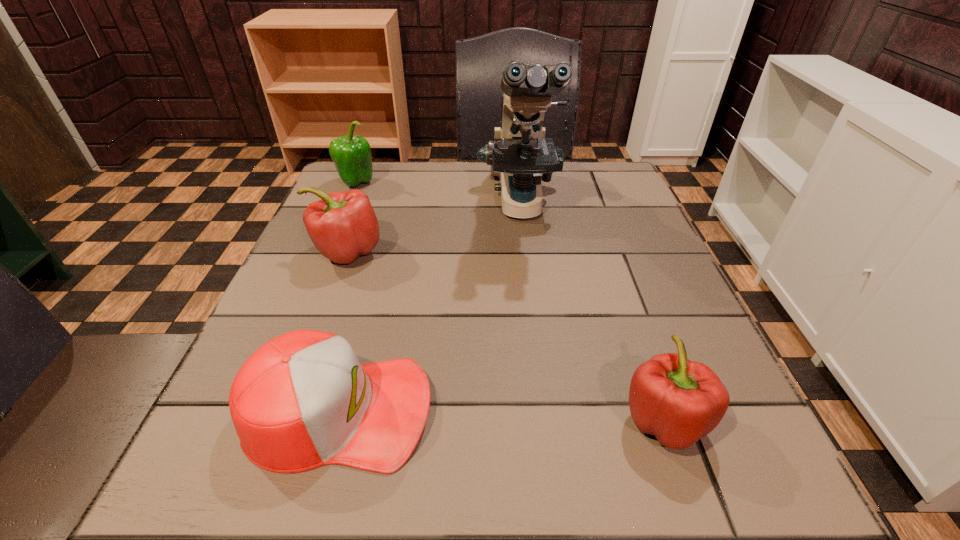
Locate an element on the screen. This screenshot has width=960, height=540. vacant space located 0.250m on the front-facing side of the baseball cap is located at coordinates (609, 410).

This screenshot has width=960, height=540. In order to click on vacant space located 0.220m on the back of the shortest bell pepper in this screenshot , I will do `click(616, 284)`.

At what (x,y) coordinates should I click in order to perform the action: click on microscope at the far edge. Please return your answer as a coordinate pair (x, y). This screenshot has height=540, width=960. Looking at the image, I should click on 519,153.

Where is `bell pepper at the far edge`? bell pepper at the far edge is located at coordinates (352, 157).

The image size is (960, 540). What are the coordinates of `baseball cap that is at the near edge` in the screenshot? It's located at (302, 400).

This screenshot has height=540, width=960. I want to click on bell pepper that is positioned at the near edge, so click(x=679, y=401).

Where is `baseball cap present at the left edge`? This screenshot has width=960, height=540. baseball cap present at the left edge is located at coordinates (302, 400).

Identify the location of object at the right edge. The height and width of the screenshot is (540, 960). (679, 401).

What are the coordinates of `object that is positioned at the far left corner` in the screenshot? It's located at (352, 157).

Where is `object that is at the near left corner`? The height and width of the screenshot is (540, 960). object that is at the near left corner is located at coordinates (302, 400).